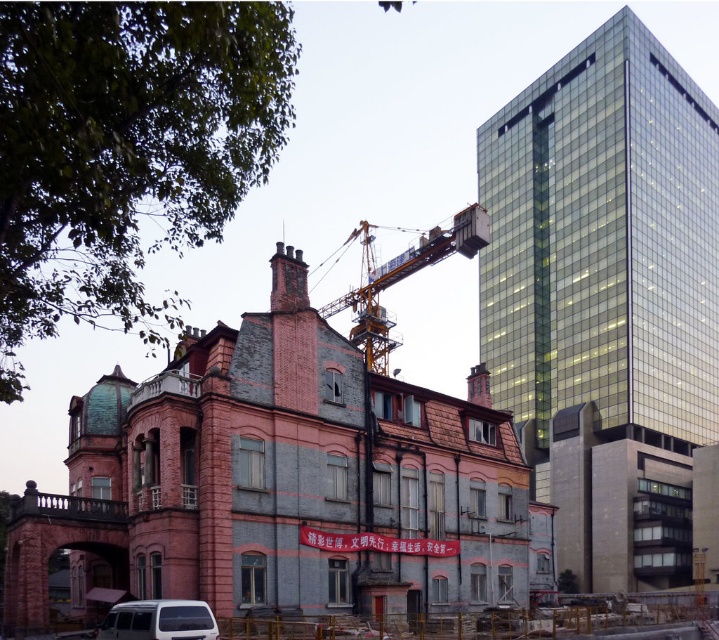
Question: Estimate the real-world distances between objects in this image. Which object is farther from the yellow metallic crane at center?

Choices:
 (A) white matte van at lower left
 (B) pink brick building at center

Answer: (A)

Question: Which object appears closest to the camera in this image?

Choices:
 (A) white matte van at lower left
 (B) pink brick building at center

Answer: (A)

Question: Does pink brick building at center appear on the left side of yellow metallic crane at center?

Choices:
 (A) no
 (B) yes

Answer: (B)

Question: Does pink brick building at center have a larger size compared to white matte van at lower left?

Choices:
 (A) no
 (B) yes

Answer: (B)

Question: Among these points, which one is farthest from the camera?

Choices:
 (A) (191, 508)
 (B) (421, 244)
 (C) (134, 612)

Answer: (B)

Question: Does yellow metallic crane at center appear under white matte van at lower left?

Choices:
 (A) yes
 (B) no

Answer: (B)